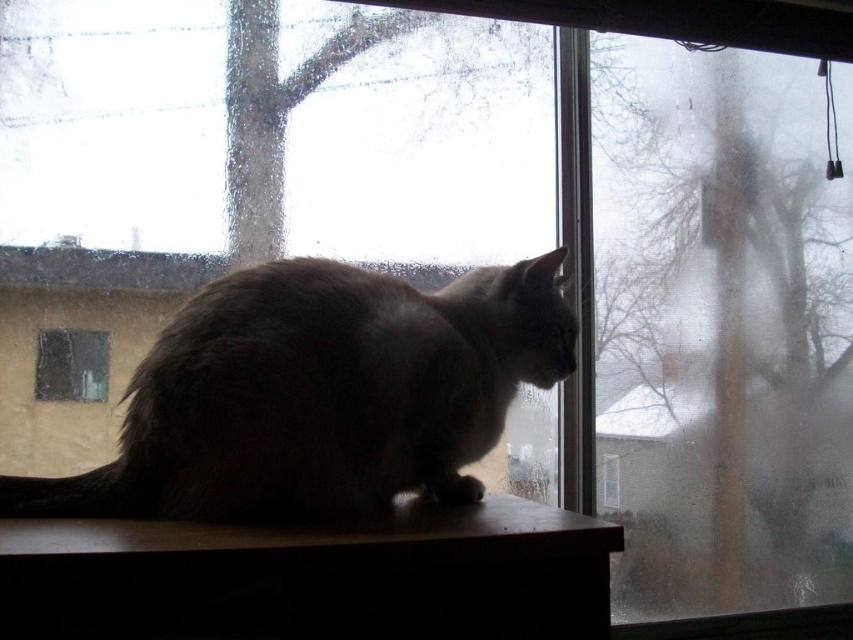
Question: Is gray fur cat at center to the left of clear glass window at center from the viewer's perspective?

Choices:
 (A) yes
 (B) no

Answer: (B)

Question: Which point is closer to the camera?

Choices:
 (A) gray fur cat at center
 (B) brown wood at lower center
 (C) clear glass window at center

Answer: (B)

Question: Is brown wood at lower center bigger than transparent glass window at center?

Choices:
 (A) no
 (B) yes

Answer: (B)

Question: Considering the real-world distances, which object is closest to the gray fur cat at center?

Choices:
 (A) clear glass window at center
 (B) transparent glass window at center

Answer: (A)

Question: Estimate the real-world distances between objects in this image. Which object is farther from the clear glass window at center?

Choices:
 (A) gray fur cat at center
 (B) transparent glass window at center
 (C) brown wood at lower center

Answer: (B)

Question: Does brown wood at lower center appear over clear glass window at center?

Choices:
 (A) no
 (B) yes

Answer: (A)